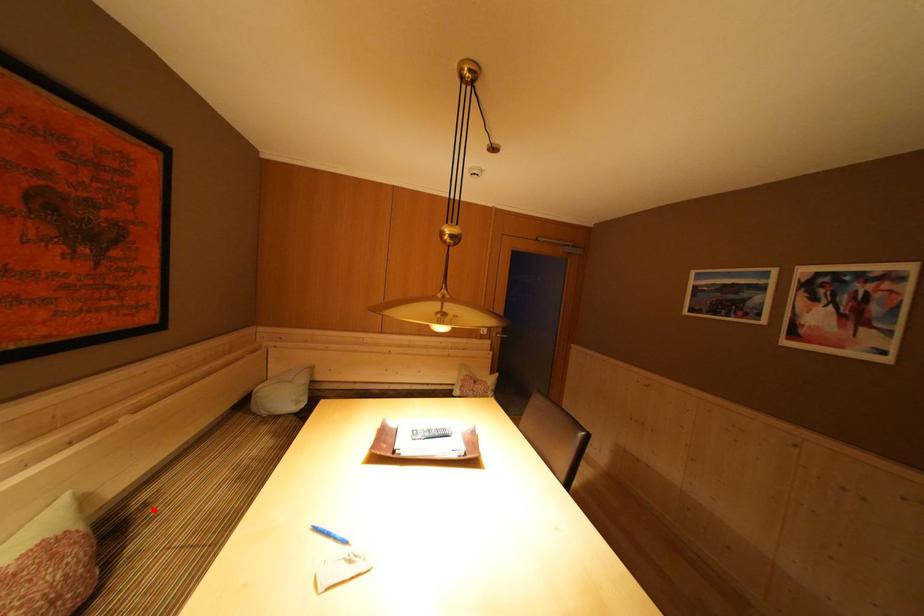
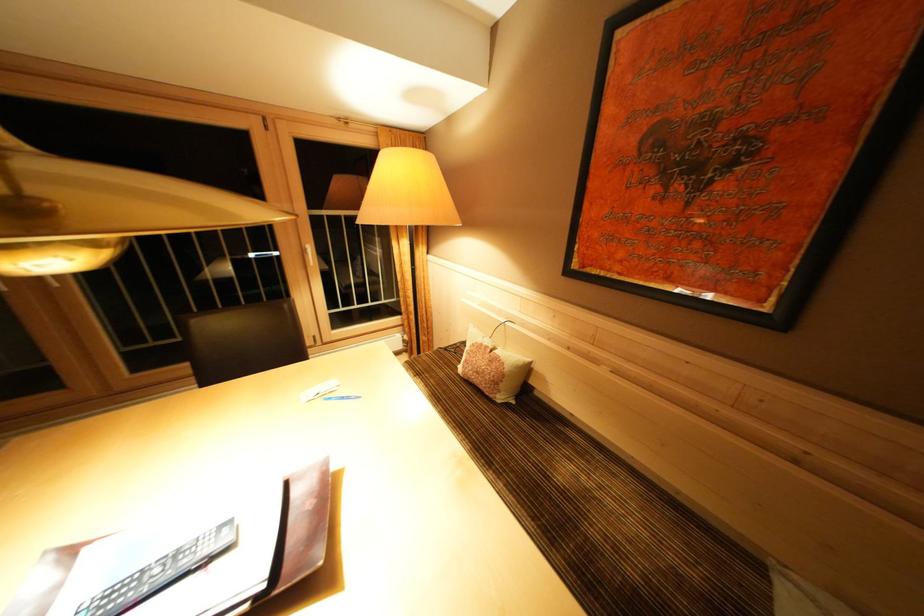
Question: I am providing you with two images of the same scene from different viewpoints. Given a red point in image1, look at the same physical point in image2. Is it:

Choices:
 (A) Closer to the viewpoint
 (B) Farther from the viewpoint

Answer: (A)